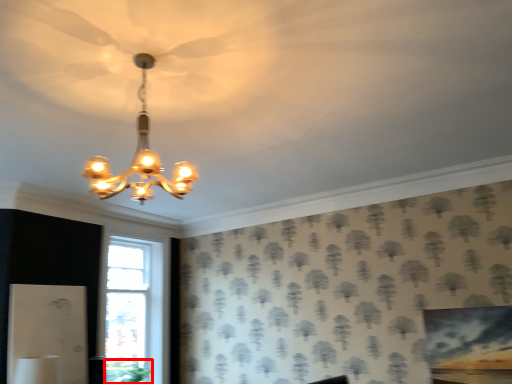
Question: From the image's perspective, considering the relative positions of plant (annotated by the red box) and lamp in the image provided, where is plant (annotated by the red box) located with respect to the staircase?

Choices:
 (A) below
 (B) above

Answer: (A)